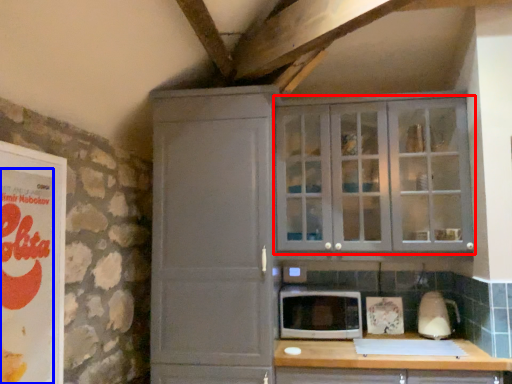
Question: Which object appears closest to the camera in this image, cupboard (highlighted by a red box) or advertisement (highlighted by a blue box)?

Choices:
 (A) cupboard
 (B) advertisement

Answer: (B)